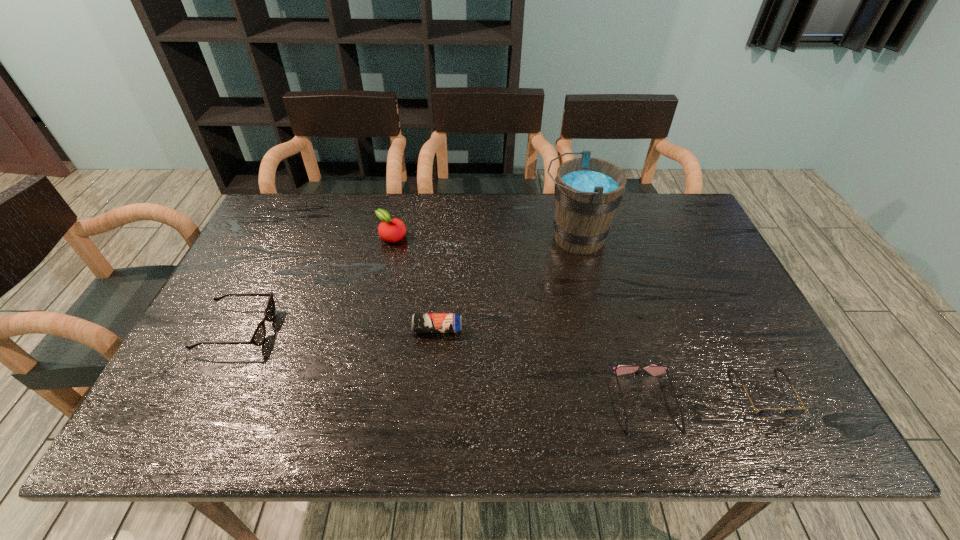
At what (x,y) coordinates should I click in order to perform the action: click on the tallest object. Please return your answer as a coordinate pair (x, y). The width and height of the screenshot is (960, 540). Looking at the image, I should click on (588, 191).

Find the location of `the fifth shortest object`. the fifth shortest object is located at coordinates (391, 230).

What are the coordinates of `apple` in the screenshot? It's located at (391, 230).

Identify the location of the farthest sunglasses. This screenshot has width=960, height=540. (258, 337).

This screenshot has width=960, height=540. In order to click on the leftmost sunglasses in this screenshot , I will do `click(258, 337)`.

Locate an element on the screen. The height and width of the screenshot is (540, 960). beer can is located at coordinates (421, 322).

Where is `the second tallest sunglasses`? the second tallest sunglasses is located at coordinates (654, 370).

Find the location of a particular element. This screenshot has width=960, height=540. the rightmost object is located at coordinates (768, 412).

Find the location of a particular element. The image size is (960, 540). the rightmost sunglasses is located at coordinates (768, 412).

Where is `vacant point located with a handle on the side of the wine bucket`? The image size is (960, 540). vacant point located with a handle on the side of the wine bucket is located at coordinates (516, 238).